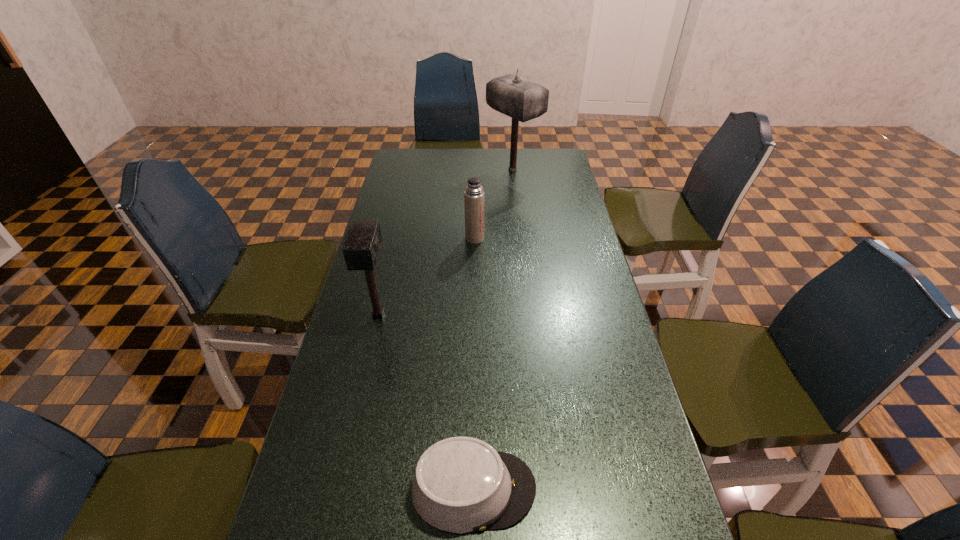
This screenshot has height=540, width=960. Find the location of `the taller mallet`. the taller mallet is located at coordinates (523, 100).

Locate an element on the screen. Image resolution: width=960 pixels, height=540 pixels. the right mallet is located at coordinates (523, 100).

You are a GUI agent. You are given a task and a screenshot of the screen. Output one action in this format:
    pyautogui.click(x=<x>, y=<y>)
    Task: Click on the second nearest object
    The width and height of the screenshot is (960, 540).
    Given the screenshot: What is the action you would take?
    pyautogui.click(x=362, y=245)

The image size is (960, 540). Identify the location of the nearer mallet. (362, 245).

The width and height of the screenshot is (960, 540). Identify the location of thermos bottle. (474, 194).

What are the coordinates of `the second shortest object` in the screenshot? It's located at (474, 194).

Locate an element on the screen. This screenshot has height=540, width=960. hat is located at coordinates (461, 484).

Identify the location of the nearest object. This screenshot has width=960, height=540. (461, 484).

The image size is (960, 540). I want to click on free space located 0.120m on the left of the farther mallet, so click(457, 170).

I want to click on vacant space positioned 0.100m on the right of the second nearest object, so click(427, 315).